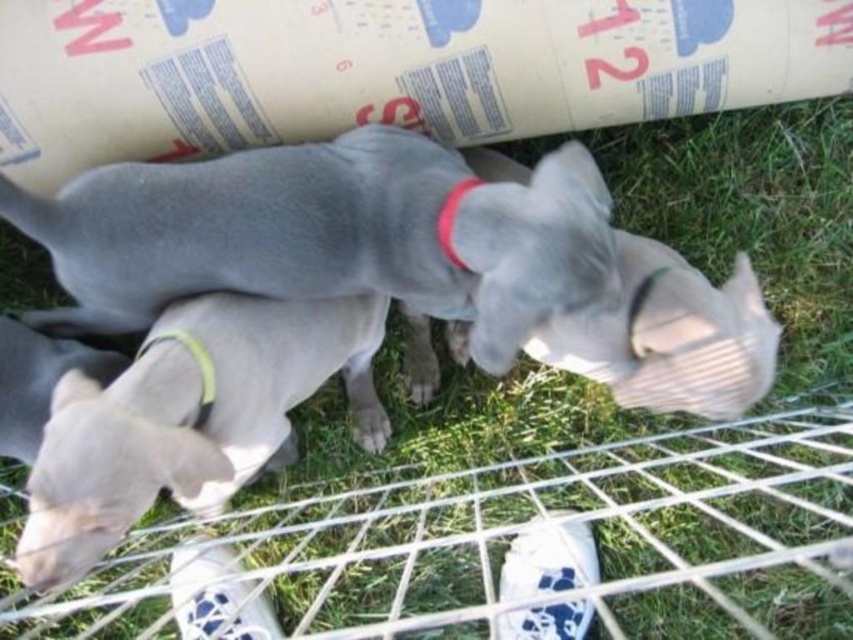
You are taking a photo of the two points labeled as point [564,264] and point [439,234] in the image. Which point will appear larger in your photo?

Point [564,264] is closer to the camera than point [439,234], so it will appear larger in the photo.